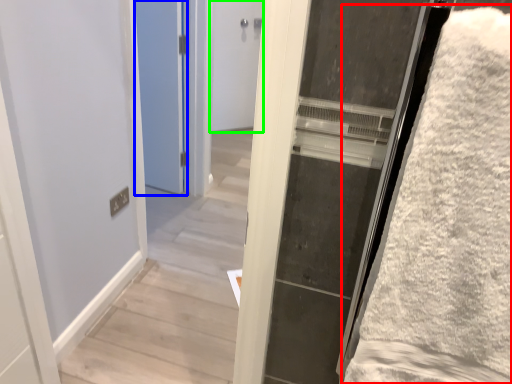
Question: Considering the real-world distances, which object is closest to bath towel (highlighted by a red box)? door (highlighted by a blue box) or door (highlighted by a green box).

Choices:
 (A) door
 (B) door

Answer: (A)